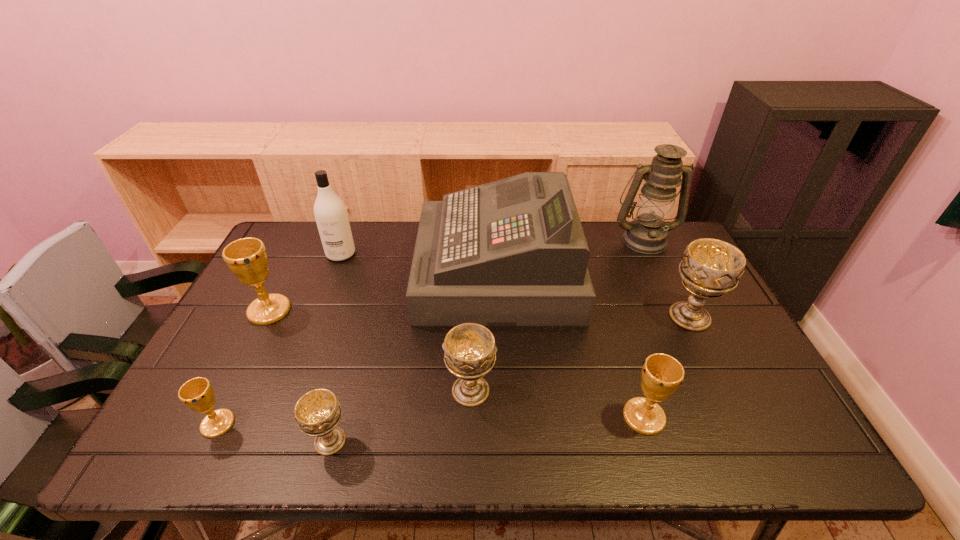
Find the location of a particular element. white chalice that stands as the closest to the third object from right to left is located at coordinates (710, 268).

The image size is (960, 540). Identify the location of white chalice identified as the second closest to the shampoo. (318, 412).

Find the location of a particular element. This screenshot has height=540, width=960. vacant region that satisfies the following two spatial constraints: 1. on the back side of the oil lamp; 2. on the right side of the biggest gold chalice is located at coordinates (305, 240).

In order to click on vacant space that satisfies the following two spatial constraints: 1. on the front-facing side of the rightmost chalice; 2. on the right side of the gray cash register in this screenshot , I will do `click(499, 316)`.

The image size is (960, 540). I want to click on free space that satisfies the following two spatial constraints: 1. on the front-facing side of the farthest white chalice; 2. on the right side of the cash register, so click(499, 316).

I want to click on vacant space that satisfies the following two spatial constraints: 1. on the front side of the oil lamp; 2. on the front-facing side of the gray cash register, so click(x=659, y=271).

The height and width of the screenshot is (540, 960). What are the coordinates of `vacant space that satisfies the following two spatial constraints: 1. on the back side of the rightmost chalice; 2. on the right side of the nearest white chalice` in the screenshot? It's located at (364, 316).

This screenshot has height=540, width=960. In order to click on free space that satisfies the following two spatial constraints: 1. on the front-facing side of the third object from right to left; 2. on the right side of the gray cash register in this screenshot , I will do `click(504, 417)`.

Identify the location of vacant space that satisfies the following two spatial constraints: 1. on the front side of the oil lamp; 2. on the front-facing side of the gray cash register. This screenshot has width=960, height=540. (659, 271).